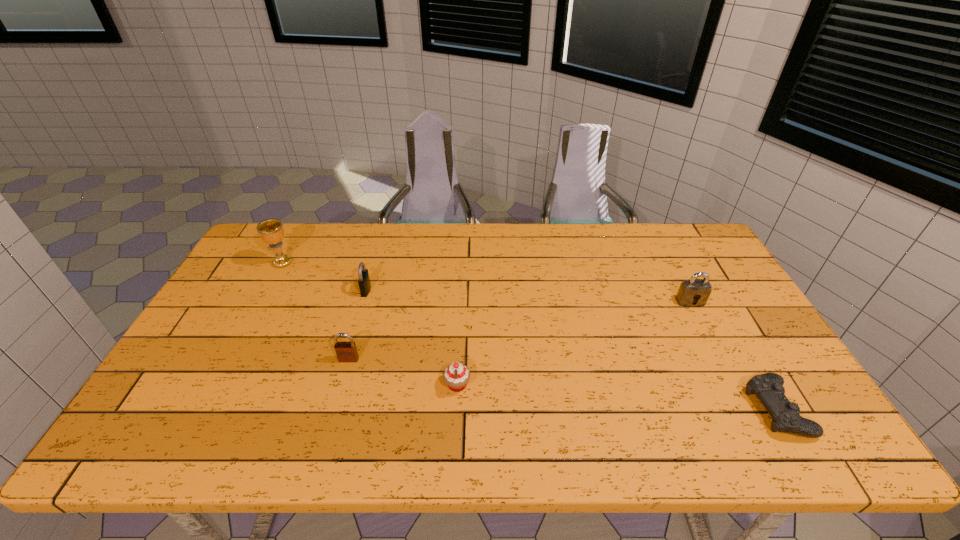
In the image, there is a desktop. Where is `vacant space at the left edge`? This screenshot has height=540, width=960. vacant space at the left edge is located at coordinates (216, 324).

You are a GUI agent. You are given a task and a screenshot of the screen. Output one action in this format:
    pyautogui.click(x=<x>, y=<y>)
    Task: Click on the free space at the right edge
    This screenshot has width=960, height=540.
    Given the screenshot: What is the action you would take?
    pyautogui.click(x=719, y=356)

I want to click on vacant space at the far left corner of the desktop, so click(247, 262).

Where is `free spot between the control and the leftmost object`? free spot between the control and the leftmost object is located at coordinates (530, 336).

You are a GUI agent. You are given a task and a screenshot of the screen. Output one action in this format:
    pyautogui.click(x=<x>, y=<y>)
    Task: Click on the vacant point located between the fourth farthest object and the leftmost object
    This screenshot has width=960, height=540.
    Given the screenshot: What is the action you would take?
    pyautogui.click(x=316, y=311)

Where is `vacant area that lies between the leftmost object and the control`? vacant area that lies between the leftmost object and the control is located at coordinates (530, 336).

You are a GUI agent. You are given a task and a screenshot of the screen. Output one action in this format:
    pyautogui.click(x=<x>, y=<y>)
    Task: Click on the free space between the nearest padlock and the leftmost object
    This screenshot has height=540, width=960.
    Given the screenshot: What is the action you would take?
    pyautogui.click(x=316, y=311)

Find the location of a particular element. The image size is (960, 540). empty location between the fourth object from left to right and the leftmost object is located at coordinates (370, 324).

Where is `object that stands as the closest to the third object from right to left`? This screenshot has width=960, height=540. object that stands as the closest to the third object from right to left is located at coordinates (346, 351).

Select which object is the third closest to the cupcake. Please provide its 2D coordinates. Your answer should be formatted as a tuple, i.e. [(x, y)], where the tuple contains the x and y coordinates of a point satisfying the conditions above.

[(690, 290)]